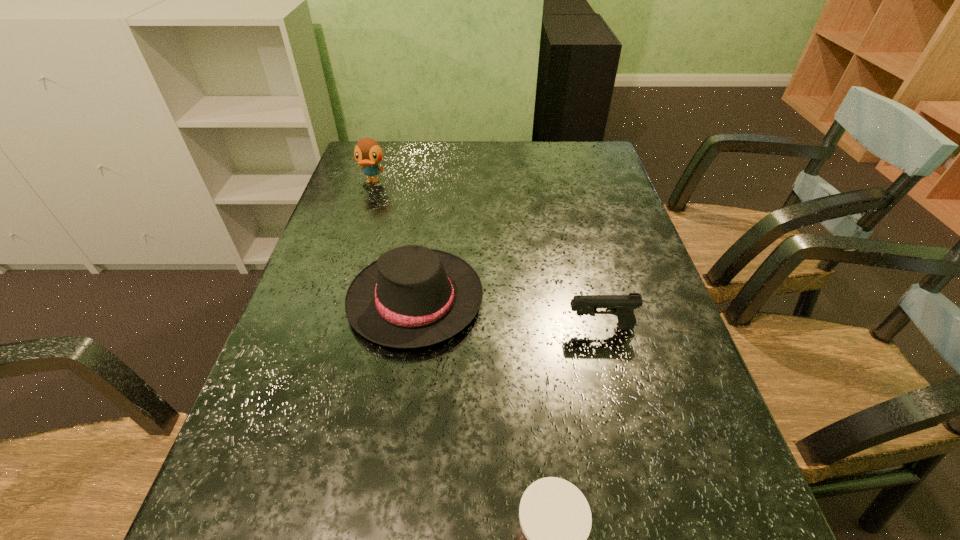
At what (x,y) coordinates should I click in order to perform the action: click on the tallest object. Please return your answer as a coordinate pair (x, y). Image resolution: width=960 pixels, height=540 pixels. Looking at the image, I should click on (368, 153).

Identify the location of the farthest object. (368, 153).

This screenshot has width=960, height=540. I want to click on dress hat, so click(412, 296).

Identify the location of pistol. This screenshot has width=960, height=540. (622, 306).

At what (x,y) coordinates should I click in order to perform the action: click on vacant area located 0.270m on the front-facing side of the duck. Please return your answer as a coordinate pair (x, y). The height and width of the screenshot is (540, 960). Looking at the image, I should click on (350, 249).

Where is `vacant region located 0.260m on the right of the dress hat`? The height and width of the screenshot is (540, 960). vacant region located 0.260m on the right of the dress hat is located at coordinates (598, 300).

This screenshot has height=540, width=960. I want to click on vacant space situated at the barrel of the pistol, so click(x=459, y=327).

Where is `free region located 0.250m at the barrel of the pistol`? free region located 0.250m at the barrel of the pistol is located at coordinates (449, 327).

You are a GUI agent. You are given a task and a screenshot of the screen. Output one action in this format:
    pyautogui.click(x=<x>, y=<y>)
    Task: Click on the free space located 0.350m at the barrel of the pistol
    The image size is (960, 540).
    Given the screenshot: What is the action you would take?
    pyautogui.click(x=403, y=327)

At what (x,y) coordinates should I click in order to perform the action: click on object positioned at the far edge. Please return your answer as a coordinate pair (x, y). The image size is (960, 540). Looking at the image, I should click on (368, 153).